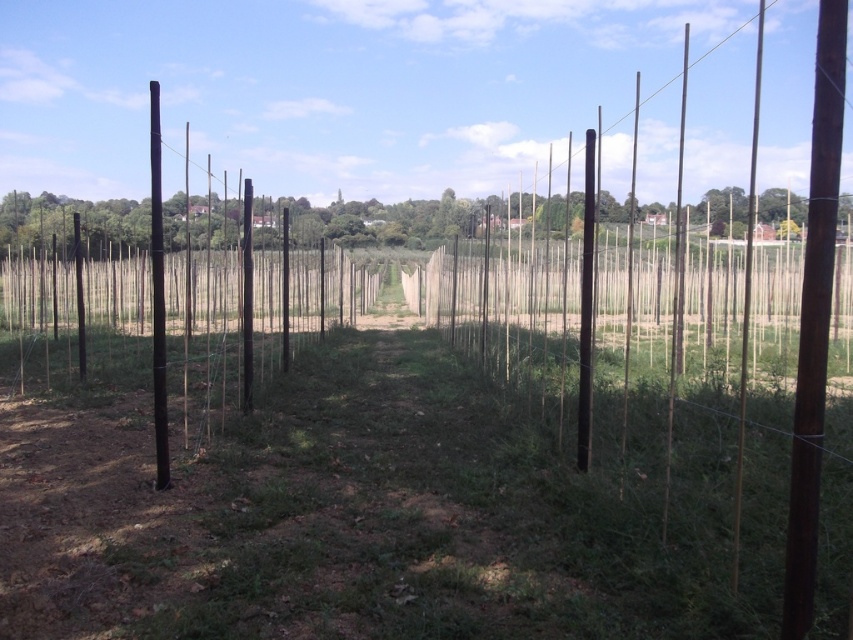
Is green wood fence at center closer to the viewer compared to black smooth pole at left?

That is True.

Where is `green wood fence at center`? green wood fence at center is located at coordinates (386, 221).

In order to click on green wood fence at center in this screenshot , I will do `click(386, 221)`.